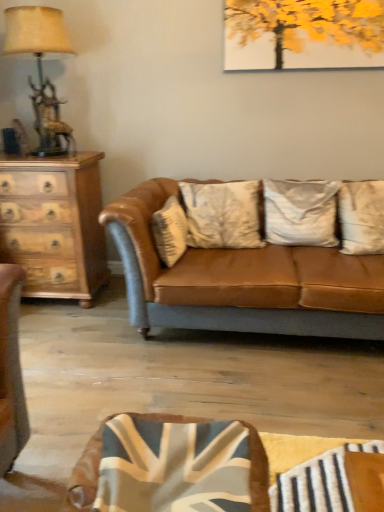
Image resolution: width=384 pixels, height=512 pixels. What are the coordinates of `free space in front of matte brown leather couch at center` in the screenshot? It's located at (256, 406).